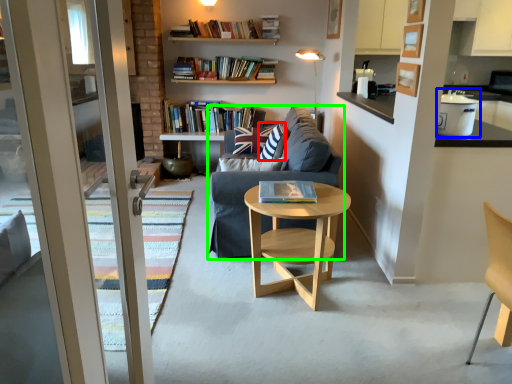
Question: Which object is the farthest from pillow (highlighted by a red box)? Choose among these: appliance (highlighted by a blue box) or studio couch (highlighted by a green box).

Choices:
 (A) appliance
 (B) studio couch

Answer: (A)